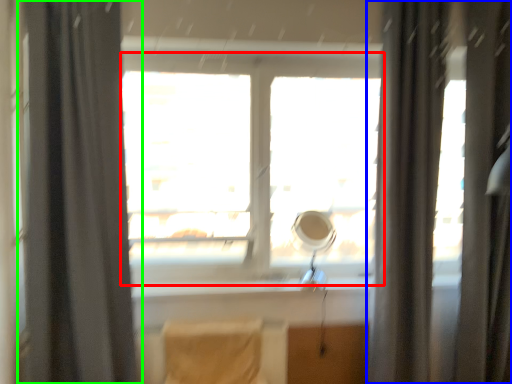
Question: Estimate the real-world distances between objects in this image. Which object is closer to window (highlighted by a red box), curtain (highlighted by a blue box) or curtain (highlighted by a green box)?

Choices:
 (A) curtain
 (B) curtain

Answer: (A)